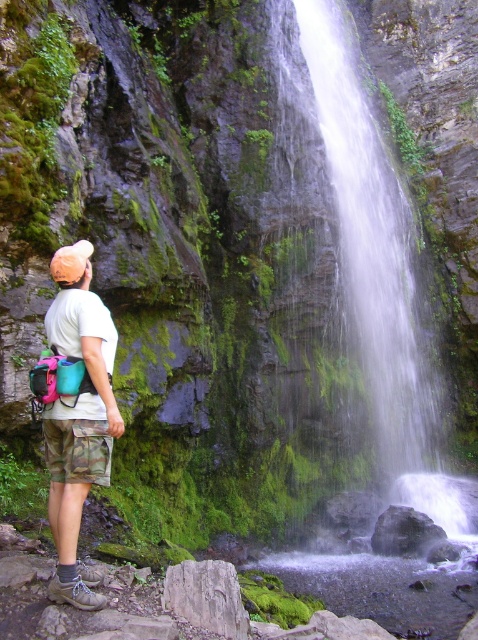
You are a hiker who wants to take a photo of the green mossy waterfall at center and the camo shorts at lower left in the same frame. Do you think you can do that without moving either object?

The green mossy waterfall at center and the camo shorts at lower left are 6.53 meters apart from each other. Since the distance is fixed and you can adjust your camera angle or zoom, you can likely capture both in the same frame without moving the objects.

You are a photographer planning to take a picture of the green mossy waterfall at center and the camo shorts at lower left. Which object should you focus on first if you want to capture both in a single frame without moving the camera?

The green mossy waterfall at center is wider than the camo shorts at lower left, so you should focus on the green mossy waterfall at center first to ensure it fits properly in the frame.

You are a photographer trying to capture the green mossy waterfall at center and the camo shorts at lower left in the same frame. Which object is taller in the image?

The green mossy waterfall at center is taller than the camo shorts at lower left.